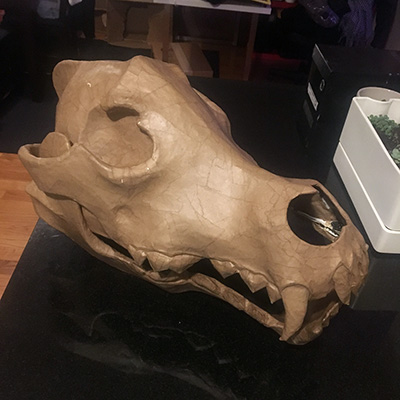
Find the location of a particular element. Image resolution: width=400 pixels, height=400 pixels. plant is located at coordinates (387, 131).